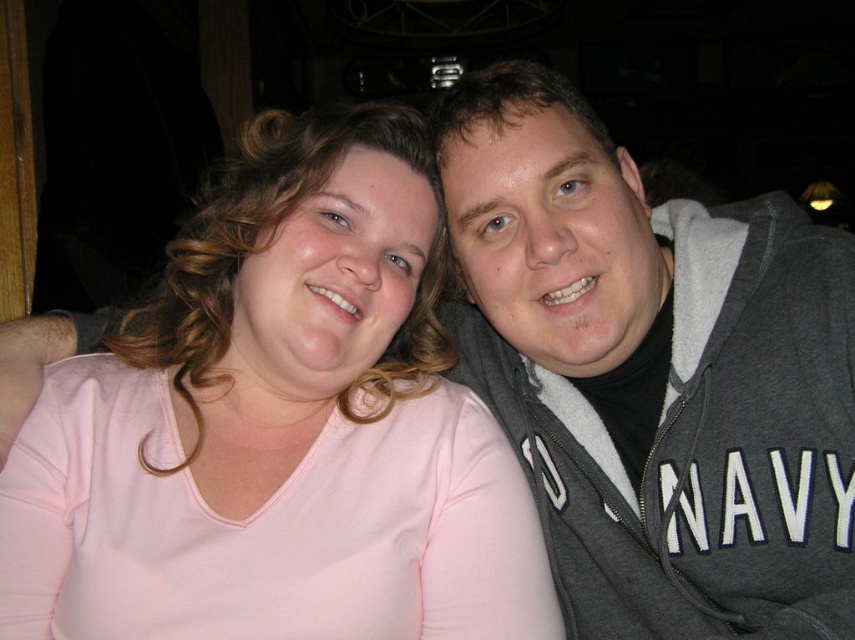
Based on the photo, which is below, pink fabric shirt at center or gray fleece hoodie at upper right?

pink fabric shirt at center is below.

Between pink fabric shirt at center and gray fleece hoodie at upper right, which one is positioned higher?

gray fleece hoodie at upper right is above.

Who is more forward, (193, 602) or (529, 224)?

Positioned in front is point (193, 602).

The image size is (855, 640). I want to click on pink fabric shirt at center, so click(278, 428).